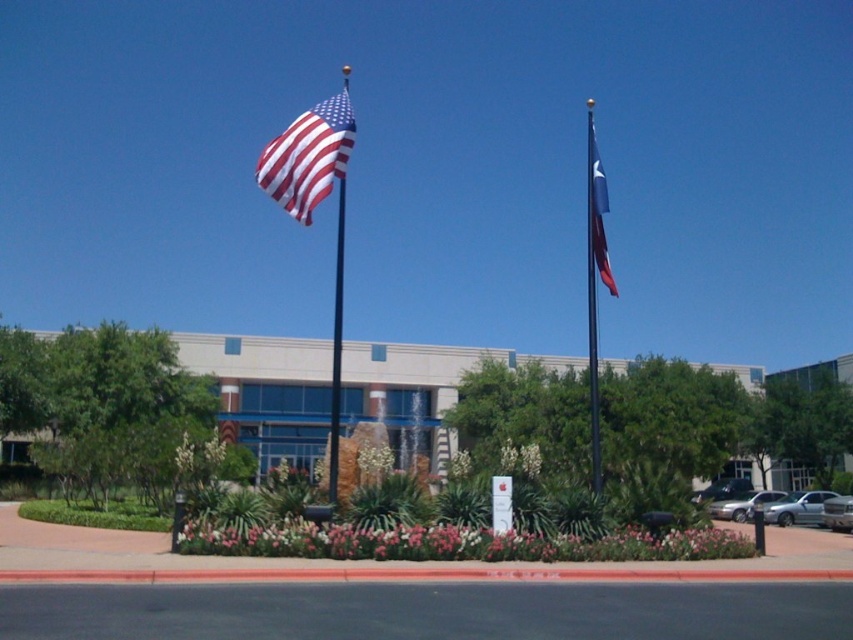
Question: Which is nearer to the metallic flag pole at center?

Choices:
 (A) matte fabric flag at upper center
 (B) satin silver sedan at center

Answer: (A)

Question: Is matte fabric flag at upper center further to the viewer compared to silver metallic sedan at center?

Choices:
 (A) yes
 (B) no

Answer: (B)

Question: Among these points, which one is nearest to the camera?

Choices:
 (A) (804, 490)
 (B) (590, 282)
 (C) (343, 113)
 (D) (708, 488)

Answer: (C)

Question: Can you confirm if blue metallic flag pole at upper left is smaller than satin silver sedan at center?

Choices:
 (A) no
 (B) yes

Answer: (A)

Question: Is satin silver sedan at lower right wider than satin silver sedan at center?

Choices:
 (A) yes
 (B) no

Answer: (A)

Question: Estimate the real-world distances between objects in this image. Which object is closer to the silver metallic sedan at lower right?

Choices:
 (A) silver metallic sedan at center
 (B) blue fabric flag at upper right
 (C) matte fabric flag at upper center

Answer: (A)